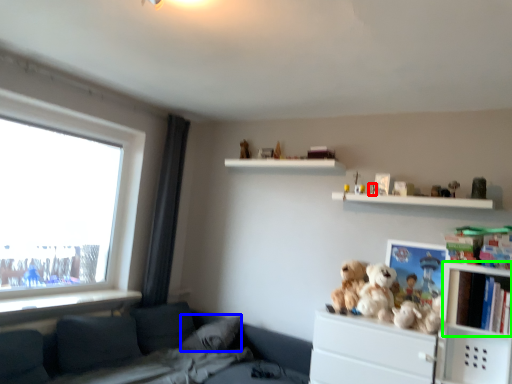
Question: Which object is the closest to the toy (highlighted by a red box)? Choose among these: pillow (highlighted by a blue box) or cabinet (highlighted by a green box).

Choices:
 (A) pillow
 (B) cabinet

Answer: (B)